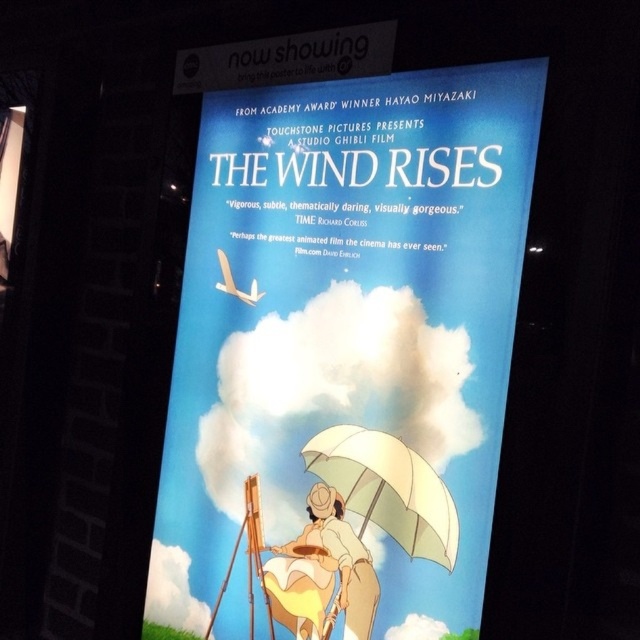
Which of these two, matte paper poster at center or white matte umbrella at center, stands shorter?

With less height is white matte umbrella at center.

Between point (316, 192) and point (371, 435), which one is positioned in front?

Point (371, 435) is in front.

Where is `matte paper poster at center`? The image size is (640, 640). matte paper poster at center is located at coordinates (346, 353).

Is the position of matte paper poster at center more distant than that of matte yellow dress at center?

That is False.

Does point (385, 584) lie in front of point (285, 572)?

Yes.

Find the location of a particular element. matte paper poster at center is located at coordinates (346, 353).

Is white matte umbrella at center closer to the viewer compared to matte yellow dress at center?

Yes, it is.

Does white matte umbrella at center have a smaller size compared to matte yellow dress at center?

No.

This screenshot has height=640, width=640. Describe the element at coordinates (387, 488) in the screenshot. I see `white matte umbrella at center` at that location.

Find the location of a particular element. white matte umbrella at center is located at coordinates (387, 488).